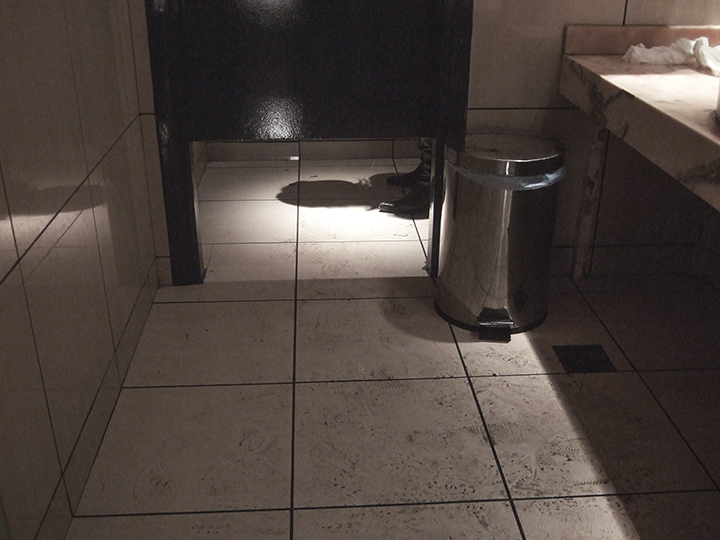
Find the location of a particular element. stall door is located at coordinates (350, 44).